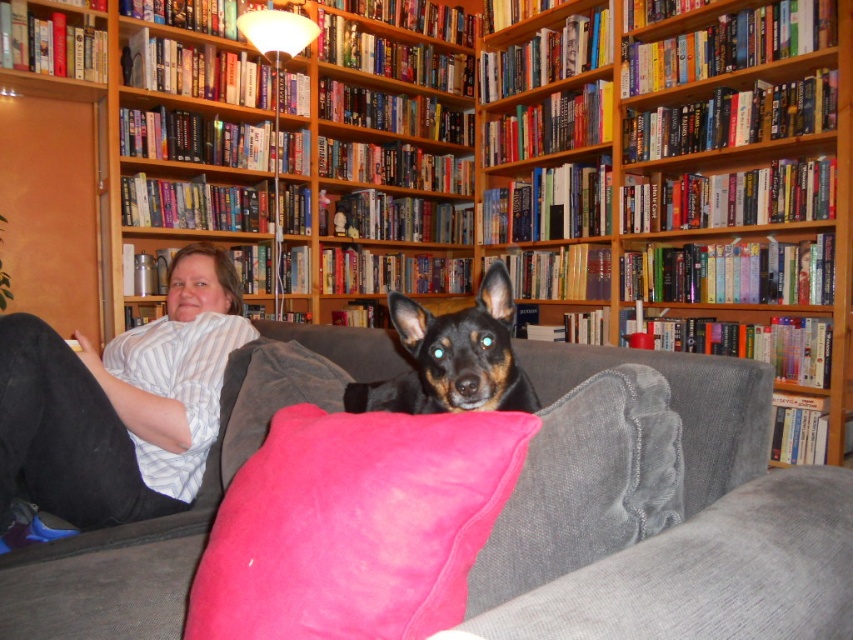
You are standing in the living room and want to place a new plant on the wooden bookshelf at upper center. To reach it, you must walk around the black smooth dog at center. Which direction should you move relative to the dog to get to the bookshelf?

You should move to the right of the black smooth dog at center to reach the wooden bookshelf at upper center, as the bookshelf is positioned to the right of the dog.

You are arranging a new painting to hang between the wooden bookshelf at upper center and the velvet pink pillow at center. Based on their positions, which side of the pillow should the painting be placed?

The wooden bookshelf at upper center is to the right of the velvet pink pillow at center, so the painting should be placed to the right side of the pillow.